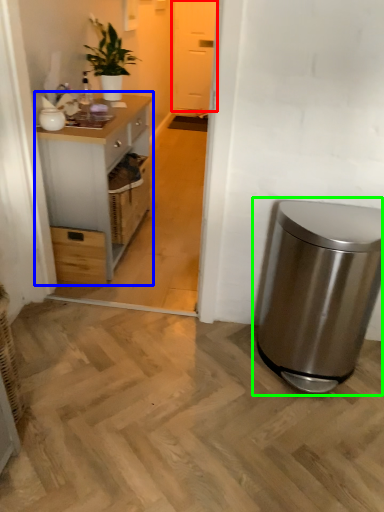
Question: Which object is the farthest from glass door (highlighted by a red box)? Choose among these: cabinetry (highlighted by a blue box) or waste container (highlighted by a green box).

Choices:
 (A) cabinetry
 (B) waste container

Answer: (B)